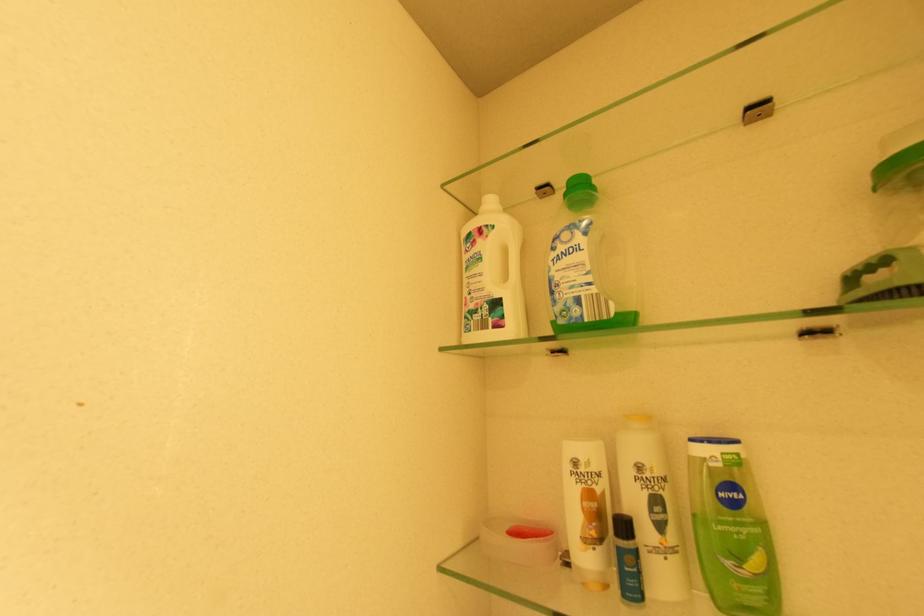
This screenshot has width=924, height=616. What do you see at coordinates (623, 525) in the screenshot?
I see `the dark bottle pump` at bounding box center [623, 525].